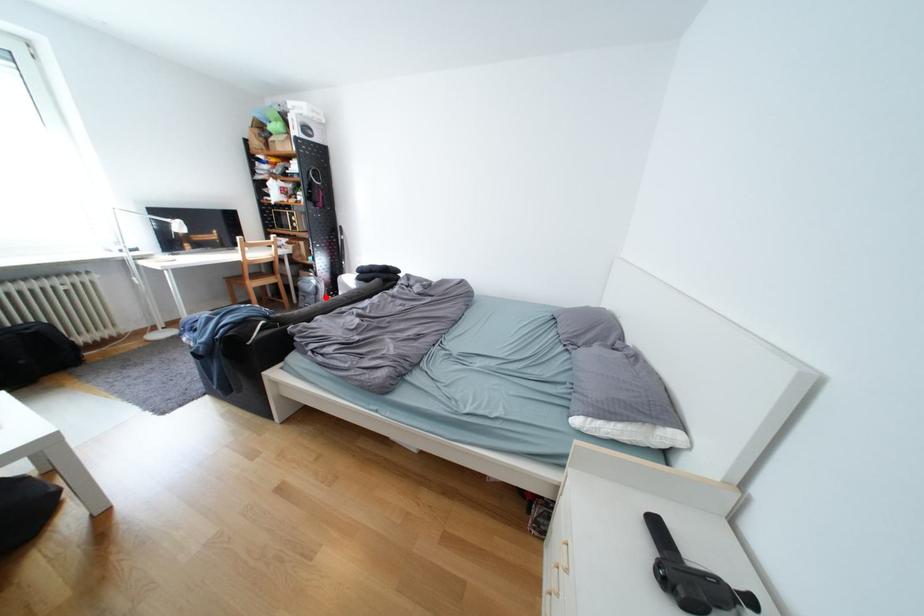
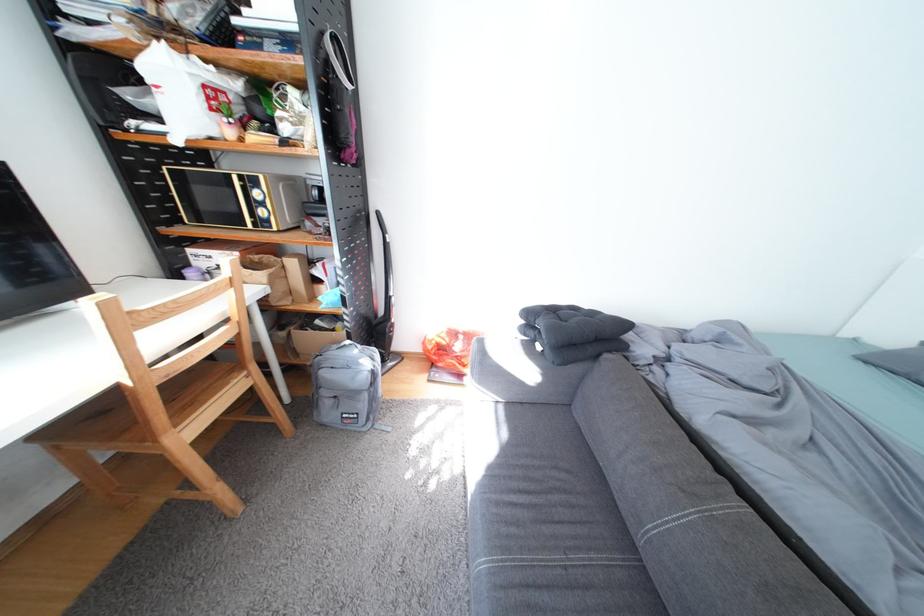
Question: I am providing you with two images of the same scene from different viewpoints. A red point is marked on the first image. Can you still see the location of the red point in image 2?

Choices:
 (A) Yes
 (B) No

Answer: (A)